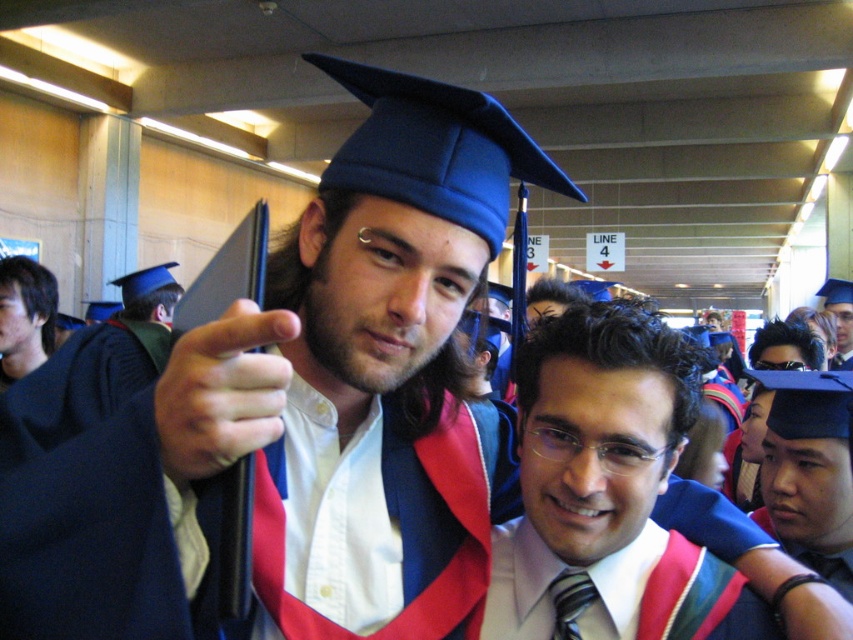
You are standing in the graduation hall and want to locate the matte white shirt at center. According to the coordinates provided, where should you look?

You should look at point (590, 467) to find the matte white shirt at center.

You are a photographer trying to capture a clear shot of the matte blue graduation cap at center and the smooth black hair at left. Which object should you focus on to ensure it is in sharp focus, considering their sizes in the frame?

The matte blue graduation cap at center occupies less space than smooth black hair at left, so to ensure it is in sharp focus, you should focus on the matte blue graduation cap at center since smaller objects require precise focusing.